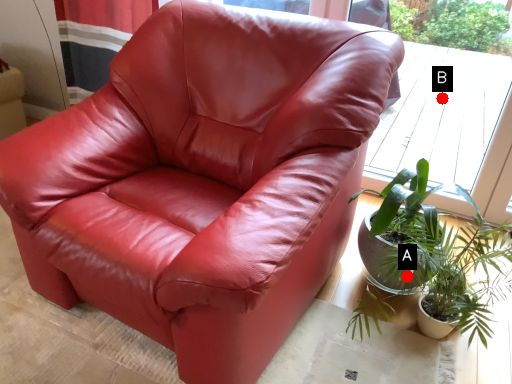
Question: Two points are circled on the image, labeled by A and B beside each circle. Which point appears farthest from the camera in this image?

Choices:
 (A) A is further
 (B) B is further

Answer: (B)